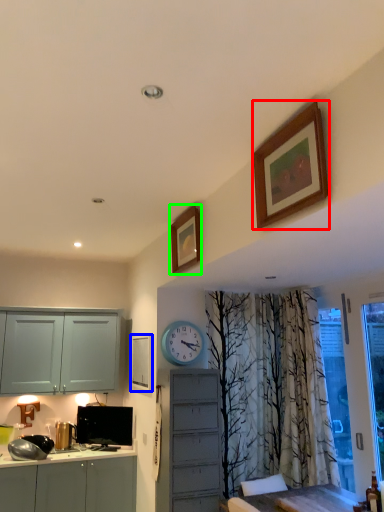
Question: Considering the real-world distances, which object is farthest from picture frame (highlighted by a red box)? picture frame (highlighted by a blue box) or picture frame (highlighted by a green box)?

Choices:
 (A) picture frame
 (B) picture frame

Answer: (A)